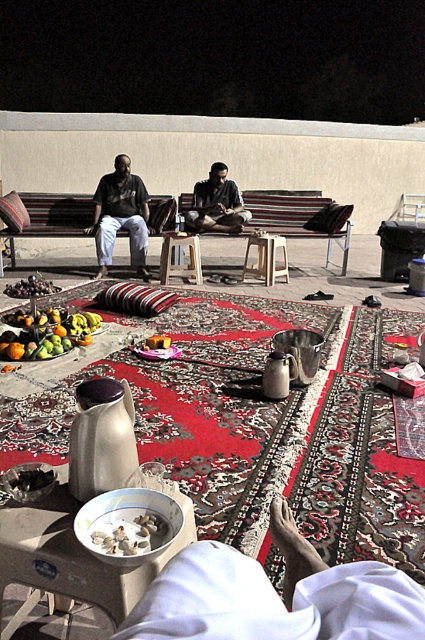
Between point (130, 253) and point (129, 522), which one is positioned in front?

Point (129, 522) is more forward.

What do you see at coordinates (121, 216) in the screenshot?
I see `matte black shirt at left` at bounding box center [121, 216].

Who is more forward, (x=142, y=262) or (x=144, y=552)?

Positioned in front is point (x=144, y=552).

Identify the location of matte black shirt at left. This screenshot has width=425, height=640. [x=121, y=216].

Does matte black shirt at left have a lesser width compared to white plastic stool at center?

No.

Which of these two, matte black shirt at left or white plastic stool at center, stands taller?

matte black shirt at left is taller.

This screenshot has width=425, height=640. What are the coordinates of `matte black shirt at left` in the screenshot? It's located at (121, 216).

Can you confirm if matte black shirt at left is positioned to the right of matte black shirt at center?

Incorrect, matte black shirt at left is not on the right side of matte black shirt at center.

Is point (125, 227) more distant than point (189, 220)?

No.

Locate an element on the screen. matte black shirt at left is located at coordinates (121, 216).